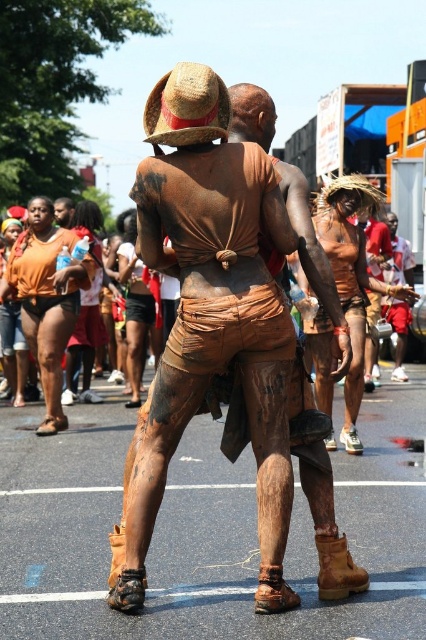
You are a photographer at the event and want to capture a closeup of the straw hat at upper center without the matte brown mud at center blocking it. What adjustment should you make to your camera angle?

The matte brown mud at center is in front of the straw hat at upper center, so you should adjust your camera angle to look upward to avoid the mud blocking the hat.

You are a photographer at the event and want to capture a photo where the straw hat at upper center is clearly visible above the matte brown mud at center. Based on their positions, is this possible?

Yes, the straw hat at upper center is positioned above the matte brown mud at center, so it can be clearly seen in the photo.

You are a photographer at this event and want to capture a shot where the straw hat at upper center is clearly visible without being blocked by the matte brown mud at center. Based on their positions, is this possible?

Yes, the straw hat at upper center is to the left of the matte brown mud at center, so positioning the camera to the left side would allow the straw hat at upper center to be visible without obstruction from the mud.